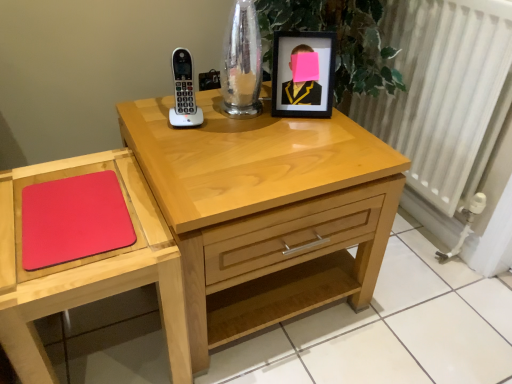
I want to click on free point below matte wooden mouse pad at lower left (from a real-world perspective), so click(x=117, y=338).